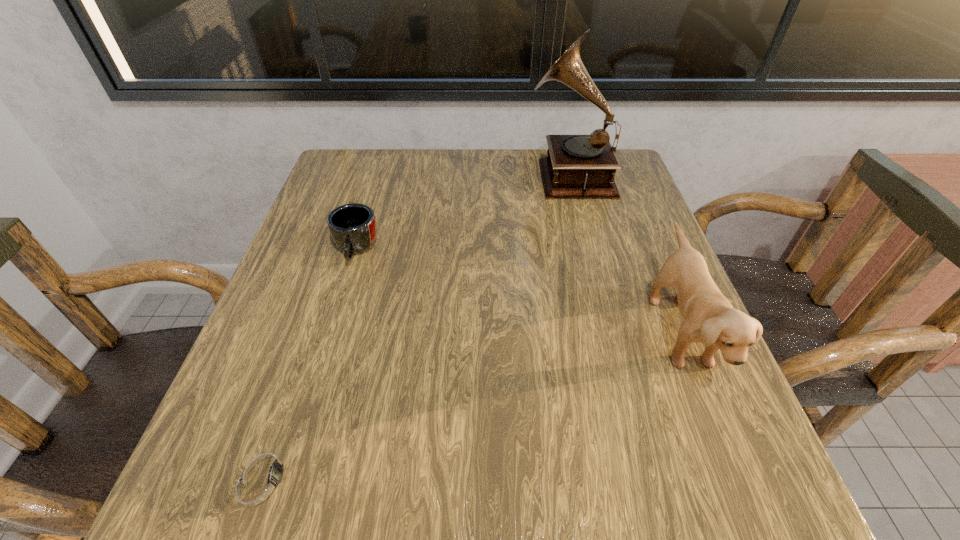
What are the coordinates of `vacant space situated on the left side of the puppy` in the screenshot? It's located at (539, 331).

Locate an element on the screen. The height and width of the screenshot is (540, 960). free location located on the left side of the puppy is located at coordinates (574, 331).

Find the location of `vacant space located on the side of the second shortest object with the handle`. vacant space located on the side of the second shortest object with the handle is located at coordinates (336, 315).

At what (x,y) coordinates should I click in order to perform the action: click on free location located on the face of the shortest object. Please return your answer as a coordinate pair (x, y). The width and height of the screenshot is (960, 540). Looking at the image, I should click on (598, 476).

The image size is (960, 540). Find the location of `object that is positioned at the far edge`. object that is positioned at the far edge is located at coordinates (577, 166).

Where is `object present at the near edge`? The height and width of the screenshot is (540, 960). object present at the near edge is located at coordinates (261, 480).

I want to click on mug present at the left edge, so click(x=352, y=226).

Identify the location of watch at the left edge. Image resolution: width=960 pixels, height=540 pixels. (261, 480).

At what (x,y) coordinates should I click in order to perform the action: click on record player at the right edge. Please return your answer as a coordinate pair (x, y). Looking at the image, I should click on (577, 166).

What are the coordinates of `puppy that is at the right edge` in the screenshot? It's located at (709, 318).